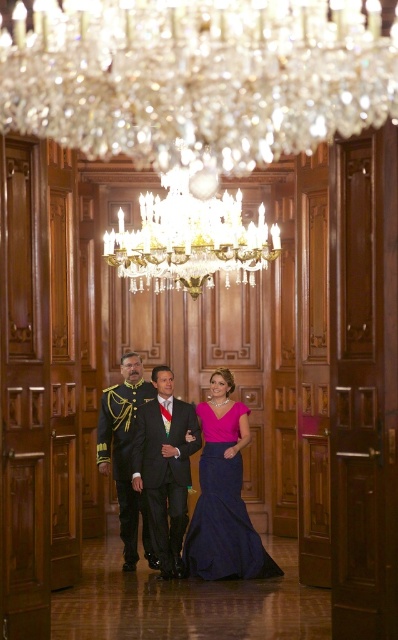
Does point (200, 429) lie behind point (130, 516)?

That is False.

This screenshot has height=640, width=398. Describe the element at coordinates (165, 467) in the screenshot. I see `shiny black suit at center` at that location.

Is point (177, 534) in front of point (130, 369)?

Yes.

This screenshot has width=398, height=640. What are the coordinates of `shiny black suit at center` in the screenshot? It's located at (165, 467).

Can you confirm if shiny navy blue gown at center is smaller than shiny black suit at center?

Actually, shiny navy blue gown at center might be larger than shiny black suit at center.

Can you confirm if shiny navy blue gown at center is positioned above shiny black suit at center?

Actually, shiny navy blue gown at center is below shiny black suit at center.

Is point (210, 436) more distant than point (167, 508)?

Yes, point (210, 436) is behind point (167, 508).

Find the location of `shiny navy blue gown at center`. shiny navy blue gown at center is located at coordinates (222, 492).

Consider the image. Which of these two, crystal glass chandelier at upper center or shiny gold uniform at center, stands shorter?

Standing shorter between the two is crystal glass chandelier at upper center.

Does crystal glass chandelier at upper center appear over shiny gold uniform at center?

Correct, crystal glass chandelier at upper center is located above shiny gold uniform at center.

Where is `crystal glass chandelier at upper center`? crystal glass chandelier at upper center is located at coordinates (197, 76).